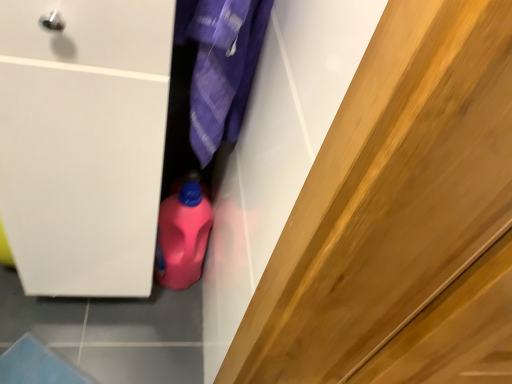
Question: From a real-world perspective, is purple fabric at center above or below pink plastic bottle at center?

Choices:
 (A) below
 (B) above

Answer: (B)

Question: Is purple fabric at center taller or shorter than pink plastic bottle at center?

Choices:
 (A) tall
 (B) short

Answer: (A)

Question: Is purple fabric at center bigger or smaller than pink plastic bottle at center?

Choices:
 (A) big
 (B) small

Answer: (A)

Question: Considering the positions of pink plastic bottle at center and purple fabric at center in the image, is pink plastic bottle at center taller or shorter than purple fabric at center?

Choices:
 (A) short
 (B) tall

Answer: (A)

Question: In the image, is pink plastic bottle at center on the left side or the right side of purple fabric at center?

Choices:
 (A) left
 (B) right

Answer: (A)

Question: Looking at the image, does pink plastic bottle at center seem bigger or smaller compared to purple fabric at center?

Choices:
 (A) small
 (B) big

Answer: (A)

Question: Considering their positions, is pink plastic bottle at center located in front of or behind purple fabric at center?

Choices:
 (A) behind
 (B) front

Answer: (A)